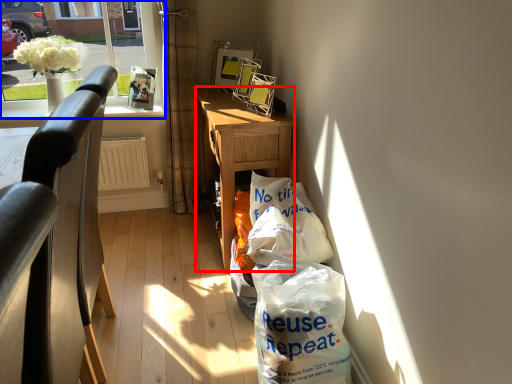
Question: Among these objects, which one is nearest to the camera, desk (highlighted by a red box) or window (highlighted by a blue box)?

Choices:
 (A) desk
 (B) window

Answer: (A)